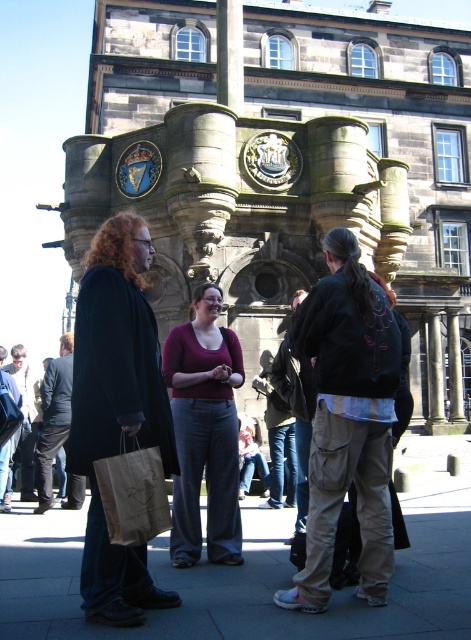
Question: Which of these objects is positioned farthest from the matte black coat at left?

Choices:
 (A) concrete pavement at center
 (B) brown paper bag at lower left

Answer: (A)

Question: Is concrete pavement at center bigger than matte burgundy sweater at center?

Choices:
 (A) no
 (B) yes

Answer: (B)

Question: Estimate the real-world distances between objects in this image. Which object is farther from the matte black coat at left?

Choices:
 (A) matte burgundy sweater at center
 (B) brown paper bag at lower left

Answer: (A)

Question: Estimate the real-world distances between objects in this image. Which object is farther from the matte burgundy sweater at center?

Choices:
 (A) concrete pavement at center
 (B) brown paper bag at lower left
 (C) matte black coat at left

Answer: (B)

Question: Does concrete pavement at center come in front of matte burgundy sweater at center?

Choices:
 (A) no
 (B) yes

Answer: (B)

Question: Is concrete pavement at center thinner than matte burgundy sweater at center?

Choices:
 (A) no
 (B) yes

Answer: (A)